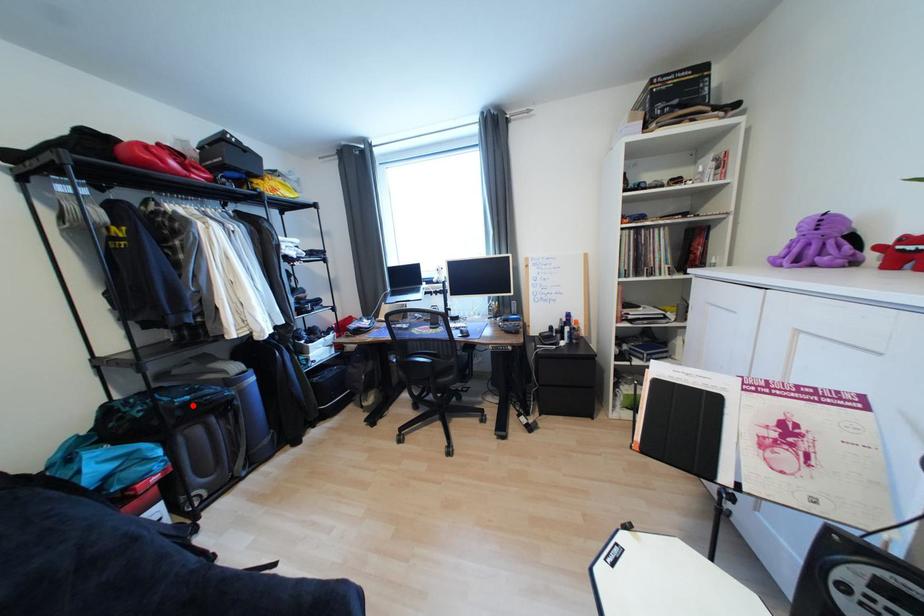
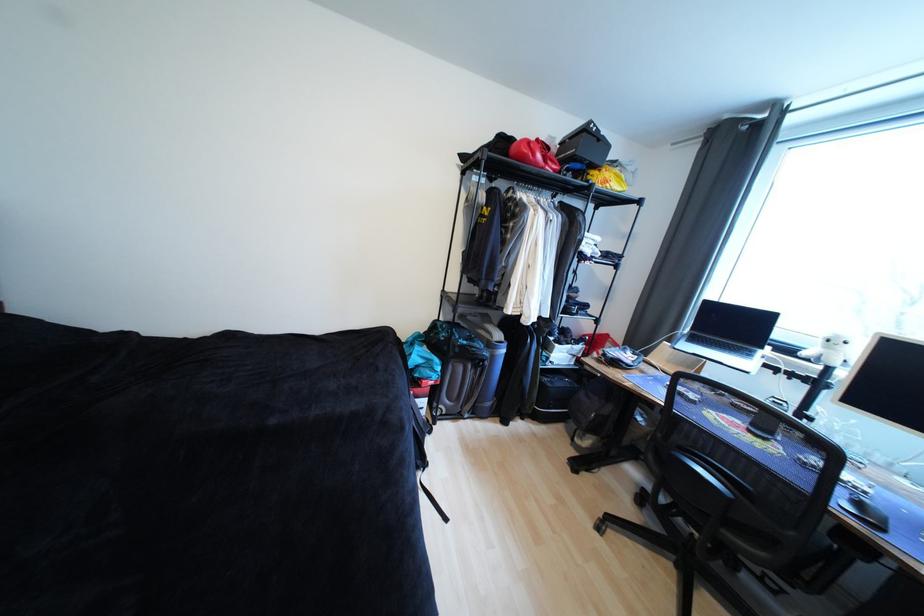
Locate, in the second image, the point that corresponds to the highlighted location in the first image.

(469, 347)